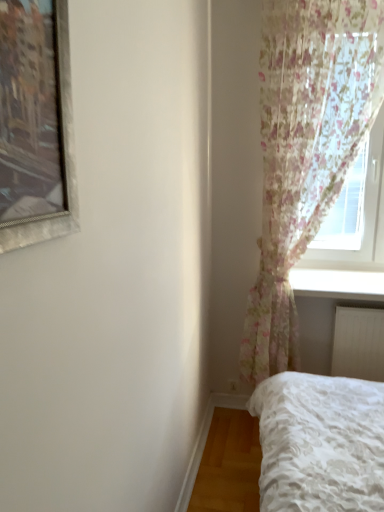
Question: Is floral sheer curtain at right at the right side of white glossy window sill at lower right?

Choices:
 (A) yes
 (B) no

Answer: (B)

Question: Can you confirm if floral sheer curtain at right is positioned to the left of white glossy window sill at lower right?

Choices:
 (A) no
 (B) yes

Answer: (B)

Question: Can you confirm if floral sheer curtain at right is thinner than white glossy window sill at lower right?

Choices:
 (A) yes
 (B) no

Answer: (A)

Question: Does floral sheer curtain at right contain white glossy window sill at lower right?

Choices:
 (A) no
 (B) yes

Answer: (A)

Question: Is floral sheer curtain at right closer to camera compared to white glossy window sill at lower right?

Choices:
 (A) no
 (B) yes

Answer: (B)

Question: Is point (291, 318) closer or farther from the camera than point (319, 291)?

Choices:
 (A) closer
 (B) farther

Answer: (A)

Question: Considering the positions of floral sheer curtain at right and white glossy window sill at lower right in the image, is floral sheer curtain at right bigger or smaller than white glossy window sill at lower right?

Choices:
 (A) small
 (B) big

Answer: (B)

Question: In the image, is floral sheer curtain at right on the left side or the right side of white glossy window sill at lower right?

Choices:
 (A) right
 (B) left

Answer: (B)

Question: Considering their positions, is floral sheer curtain at right located in front of or behind white glossy window sill at lower right?

Choices:
 (A) front
 (B) behind

Answer: (A)

Question: Considering the positions of white glossy window sill at lower right and floral sheer curtain at right in the image, is white glossy window sill at lower right wider or thinner than floral sheer curtain at right?

Choices:
 (A) wide
 (B) thin

Answer: (A)

Question: From the image's perspective, relative to floral sheer curtain at right, is white glossy window sill at lower right above or below?

Choices:
 (A) above
 (B) below

Answer: (B)

Question: Is point (360, 273) closer or farther from the camera than point (369, 50)?

Choices:
 (A) farther
 (B) closer

Answer: (A)

Question: From a real-world perspective, is white glossy window sill at lower right physically located above or below floral sheer curtain at right?

Choices:
 (A) above
 (B) below

Answer: (B)

Question: Is white plastic radiator at lower right to the left or to the right of white glossy window sill at lower right in the image?

Choices:
 (A) right
 (B) left

Answer: (A)

Question: Looking at the image, does white plastic radiator at lower right seem bigger or smaller compared to white glossy window sill at lower right?

Choices:
 (A) small
 (B) big

Answer: (A)